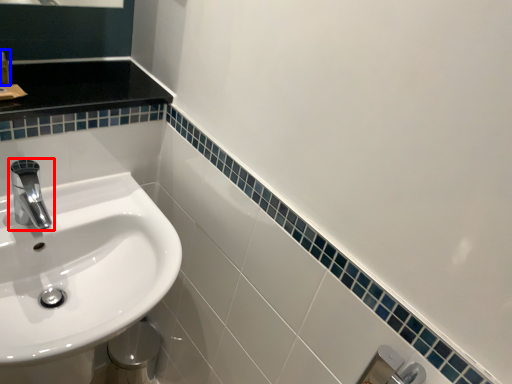
Question: Which object appears closest to the camera in this image, tap (highlighted by a red box) or toiletry (highlighted by a blue box)?

Choices:
 (A) tap
 (B) toiletry

Answer: (A)